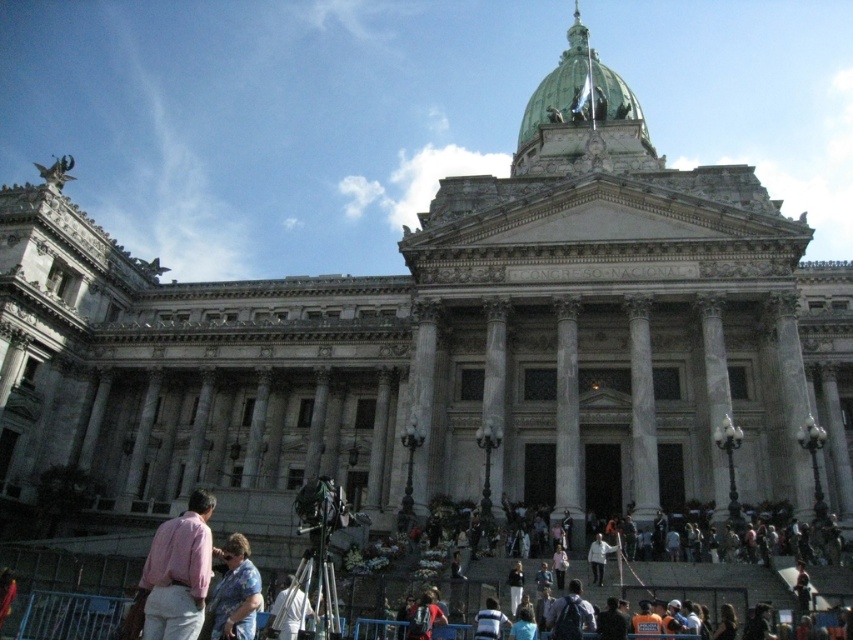
You are standing in front of the CONGRESO NACIONAL building and want to take a photo. You have two points marked in your camera viewfinder at coordinates point (610, 156) and point (200, 637). Which point is closer to your camera lens?

Point (200, 637) is closer to the camera lens because the description states that point (610, 156) is further away from the camera than point (200, 637).

You are a photographer standing in front of the CONGRESO NACIONAL building. You want to take a photo that includes both the green polished dome at upper center and the white fabric shirt at lower center. Given that your camera has a maximum zoom range of 100 meters, can you capture both objects in a single frame without moving your position?

The green polished dome at upper center and the white fabric shirt at lower center are 66.34 meters apart. Since the camera has a maximum zoom range of 100 meters, which is greater than the distance between them, you can capture both objects in a single frame without moving your position.